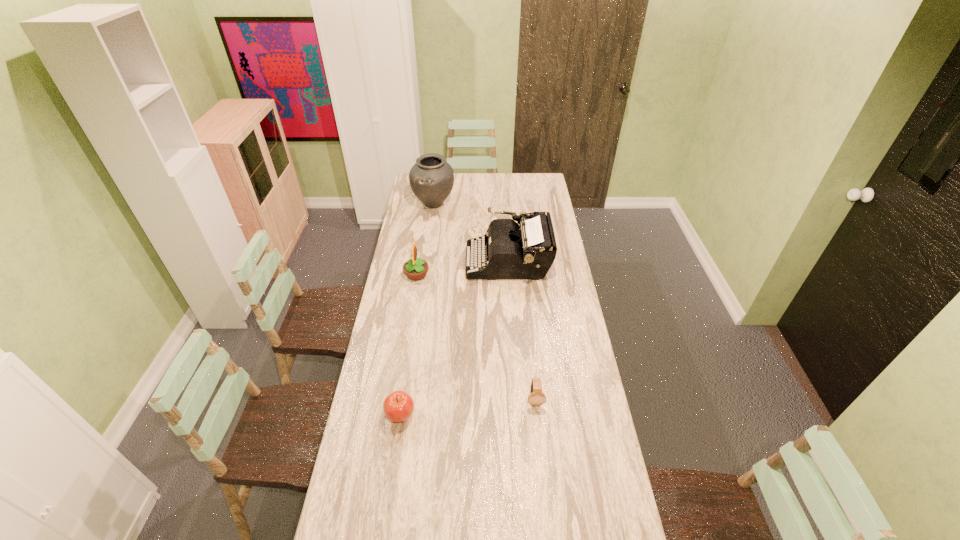
The image size is (960, 540). I want to click on free space at the left edge, so click(336, 522).

At what (x,y) coordinates should I click in order to perform the action: click on vacant space at the right edge of the desktop. Please return your answer as a coordinate pair (x, y). Image resolution: width=960 pixels, height=540 pixels. Looking at the image, I should click on (558, 308).

I want to click on vacant space in between the watch and the third tallest object, so click(475, 337).

I want to click on blank region between the typewriter and the third tallest object, so click(x=463, y=268).

Locate an element on the screen. free area in between the sunflower and the typewriter is located at coordinates (463, 268).

This screenshot has width=960, height=540. I want to click on vacant space that is in between the sunflower and the farthest object, so click(x=425, y=239).

Where is `blank region between the third tallest object and the urn`? blank region between the third tallest object and the urn is located at coordinates (425, 239).

Where is `free space that is in between the watch and the sunflower`? Image resolution: width=960 pixels, height=540 pixels. free space that is in between the watch and the sunflower is located at coordinates (475, 337).

Identify the location of empty location between the watch and the apple. The height and width of the screenshot is (540, 960). (468, 408).

Locate an element on the screen. The height and width of the screenshot is (540, 960). unoccupied area between the typewriter and the farthest object is located at coordinates (471, 232).